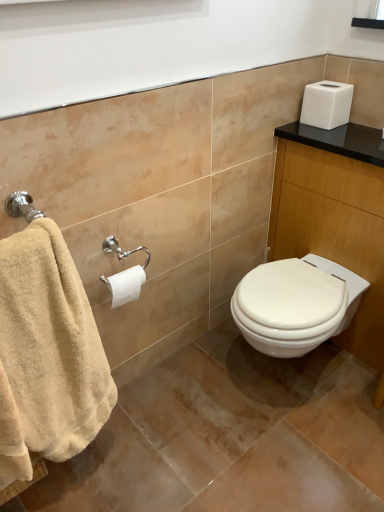
The image size is (384, 512). I want to click on vacant space in beige cotton towel at left (from a real-world perspective), so click(82, 480).